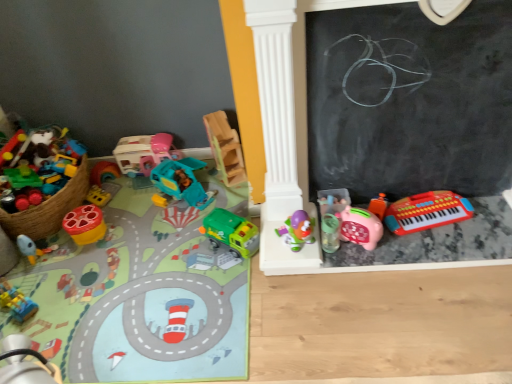
Find the location of a particular element. This screenshot has height=384, width=512. free region on the left part of shiny plastic toy at left, the tenth toy positioned from the right is located at coordinates (56, 241).